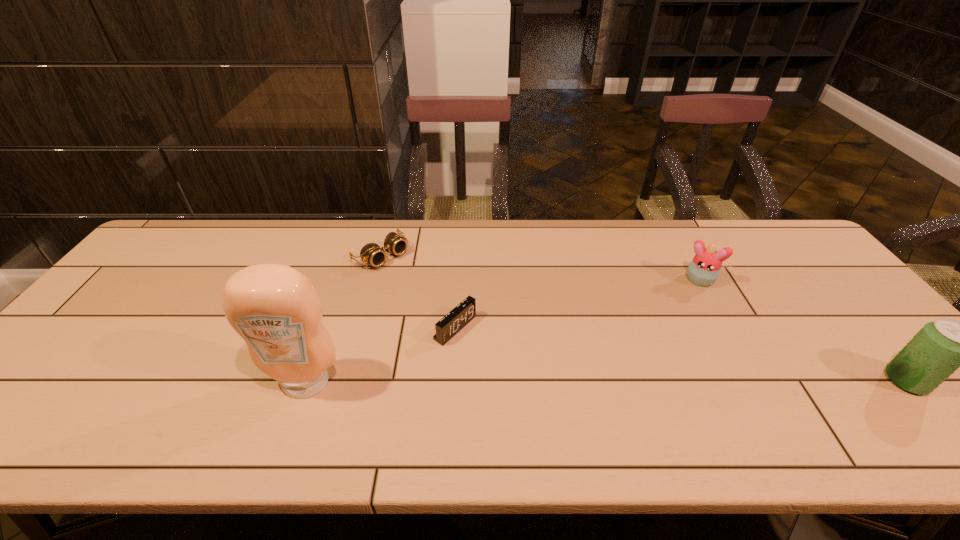
At what (x,y) coordinates should I click in order to perform the action: click on soda located in the near edge section of the desktop. Please return your answer as a coordinate pair (x, y). This screenshot has width=960, height=540. Looking at the image, I should click on (939, 348).

Image resolution: width=960 pixels, height=540 pixels. I want to click on object located in the right edge section of the desktop, so click(x=939, y=348).

Where is `object that is at the near right corner`? The image size is (960, 540). object that is at the near right corner is located at coordinates (939, 348).

I want to click on vacant space at the far edge, so click(x=440, y=222).

The image size is (960, 540). Identify the location of free space at the near edge of the desktop. (617, 412).

Where is `vacant space at the left edge of the desktop`? The height and width of the screenshot is (540, 960). vacant space at the left edge of the desktop is located at coordinates (112, 335).

The width and height of the screenshot is (960, 540). Find the location of `vacant region at the right edge of the desktop`. vacant region at the right edge of the desktop is located at coordinates (877, 328).

Identify the location of vacant region at the far right corner. This screenshot has width=960, height=540. (775, 242).

Image resolution: width=960 pixels, height=540 pixels. I want to click on blank region between the tallest object and the cupcake, so click(x=501, y=332).

Locate an element on the screen. vacant space that is in between the fourth object from left to right and the third object from left to right is located at coordinates (576, 305).